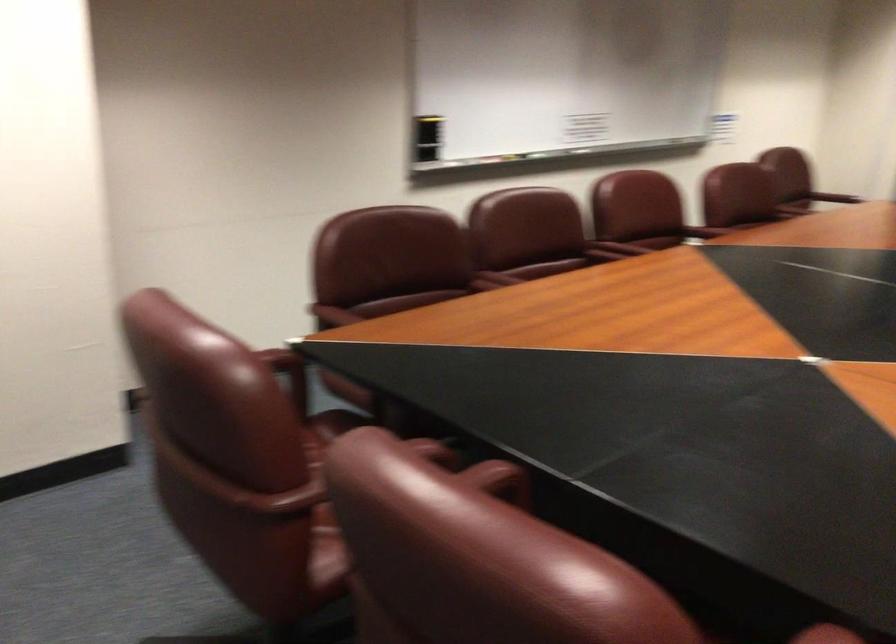
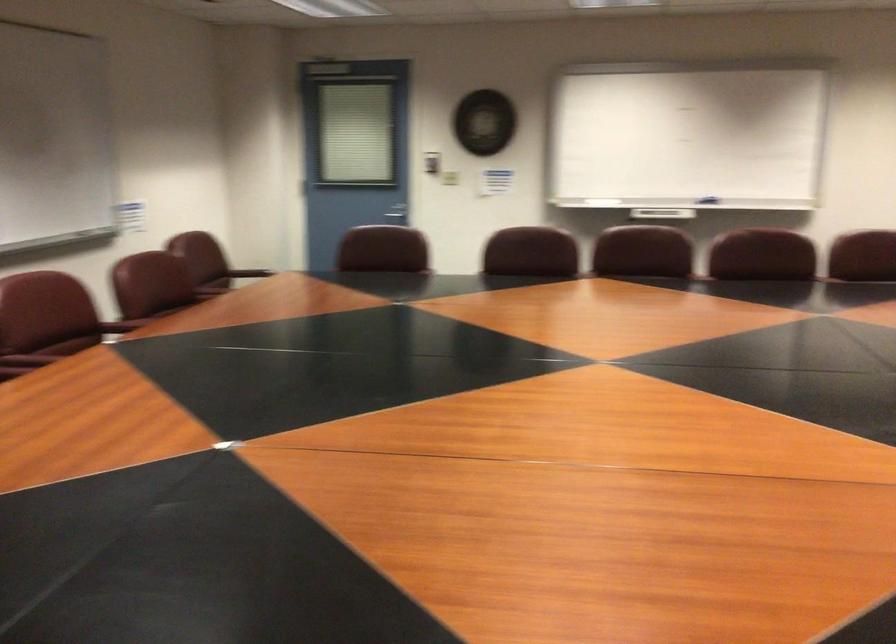
Question: How did the camera likely rotate?

Choices:
 (A) Left
 (B) Right
 (C) Up
 (D) Down

Answer: (B)